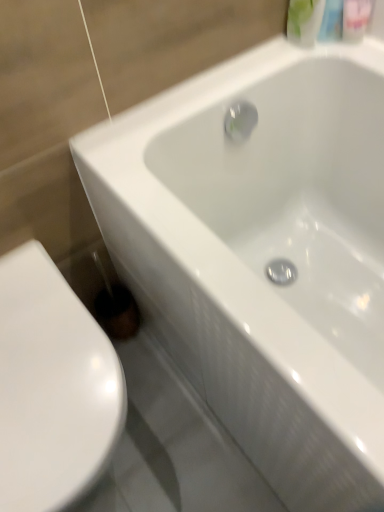
At what (x,y) coordinates should I click in order to perform the action: click on vacant area to the left of translucent plastic mouthwash at upper right, which is the first mouthwash from right to left. Please return your answer as a coordinate pair (x, y). This screenshot has width=384, height=512. Looking at the image, I should click on (280, 60).